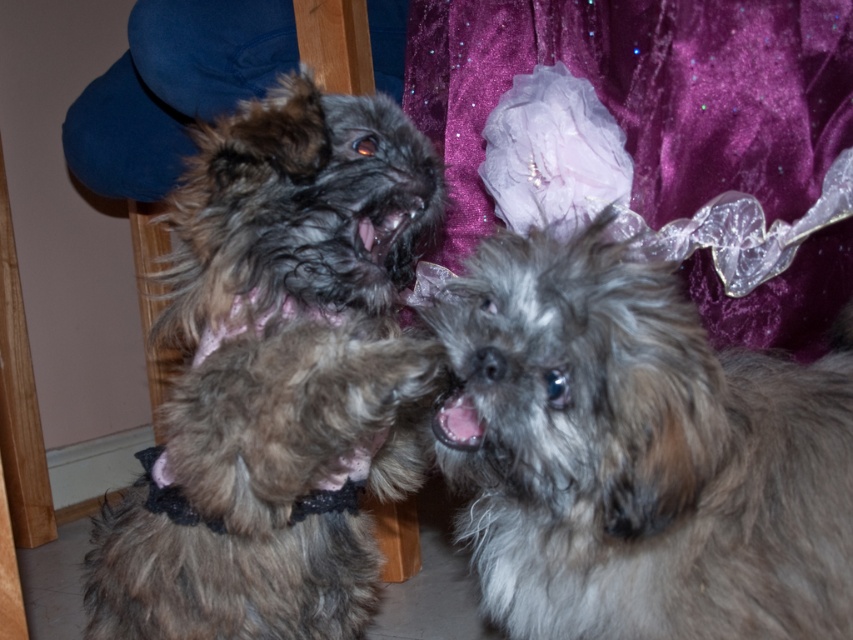
Does fuzzy gray dog at center appear under fuzzy brown fur at center?

Indeed, fuzzy gray dog at center is positioned under fuzzy brown fur at center.

Between point (782, 609) and point (233, 497), which one is positioned in front?

Point (782, 609)

Measure the distance between fuzzy gray dog at center and camera.

fuzzy gray dog at center is 25.09 inches away from camera.

Identify the location of fuzzy gray dog at center. (636, 454).